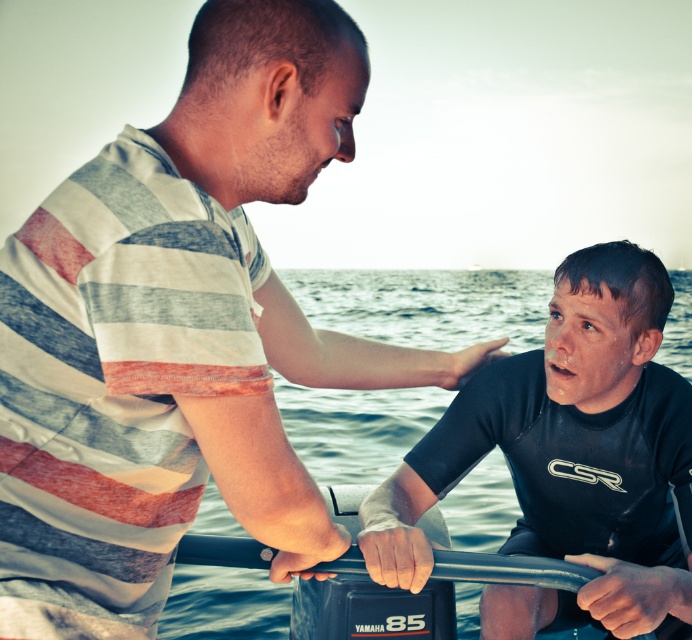
Question: Among these objects, which one is nearest to the camera?

Choices:
 (A) clear blue water at lower center
 (B) black matte wetsuit at center
 (C) striped cotton shirt at upper left

Answer: (C)

Question: Which point is closer to the camera?

Choices:
 (A) striped cotton shirt at upper left
 (B) clear blue water at lower center
 (C) black matte wetsuit at center

Answer: (A)

Question: Is striped cotton shirt at upper left smaller than black matte wetsuit at center?

Choices:
 (A) yes
 (B) no

Answer: (A)

Question: Is striped cotton shirt at upper left below clear blue water at lower center?

Choices:
 (A) yes
 (B) no

Answer: (A)

Question: Is the position of striped cotton shirt at upper left less distant than that of clear blue water at lower center?

Choices:
 (A) no
 (B) yes

Answer: (B)

Question: Which point is farther from the camera taking this photo?

Choices:
 (A) (453, 513)
 (B) (28, 344)
 (C) (543, 492)

Answer: (A)